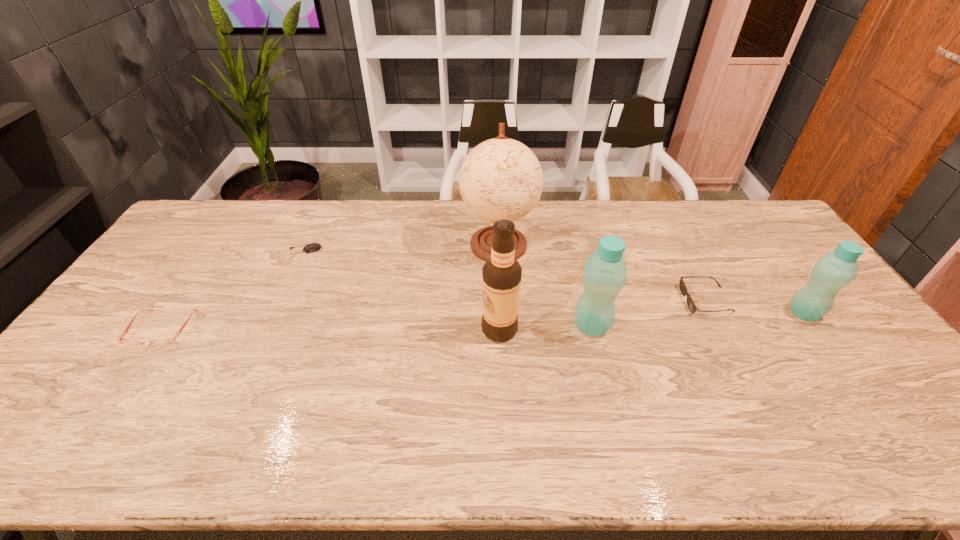
The image size is (960, 540). Identify the location of vacant place for an extra bottle on the left. (367, 339).